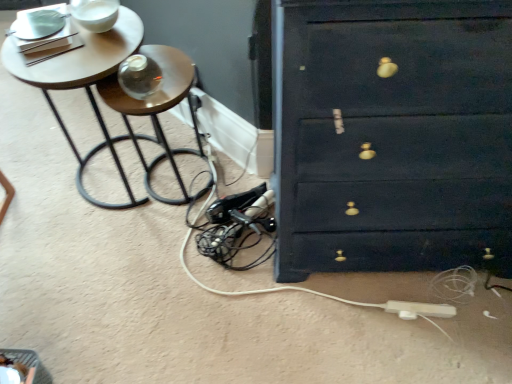
Question: From a real-world perspective, is wooden round table at upper left beneath wooden side table at left?

Choices:
 (A) no
 (B) yes

Answer: (A)

Question: Can you confirm if wooden round table at upper left is wider than wooden side table at left?

Choices:
 (A) no
 (B) yes

Answer: (B)

Question: Can wooden side table at left be found inside wooden round table at upper left?

Choices:
 (A) yes
 (B) no

Answer: (A)

Question: Is wooden round table at upper left oriented towards wooden side table at left?

Choices:
 (A) yes
 (B) no

Answer: (B)

Question: Is wooden round table at upper left positioned far away from wooden side table at left?

Choices:
 (A) yes
 (B) no

Answer: (B)

Question: From the image's perspective, does wooden round table at upper left appear lower than wooden side table at left?

Choices:
 (A) yes
 (B) no

Answer: (B)

Question: Is the surface of wooden side table at left in direct contact with wooden round table at upper left?

Choices:
 (A) yes
 (B) no

Answer: (B)

Question: Does wooden side table at left have a lesser height compared to wooden round table at upper left?

Choices:
 (A) yes
 (B) no

Answer: (A)

Question: Is wooden side table at left further to the viewer compared to wooden round table at upper left?

Choices:
 (A) no
 (B) yes

Answer: (B)

Question: Considering the relative sizes of wooden side table at left and wooden round table at upper left in the image provided, is wooden side table at left thinner than wooden round table at upper left?

Choices:
 (A) no
 (B) yes

Answer: (B)

Question: Can you confirm if wooden side table at left is positioned to the left of wooden round table at upper left?

Choices:
 (A) no
 (B) yes

Answer: (A)

Question: Can you confirm if wooden side table at left is smaller than wooden round table at upper left?

Choices:
 (A) yes
 (B) no

Answer: (A)

Question: Is white plastic extension cord at lower right inside wooden round table at upper left?

Choices:
 (A) yes
 (B) no

Answer: (B)